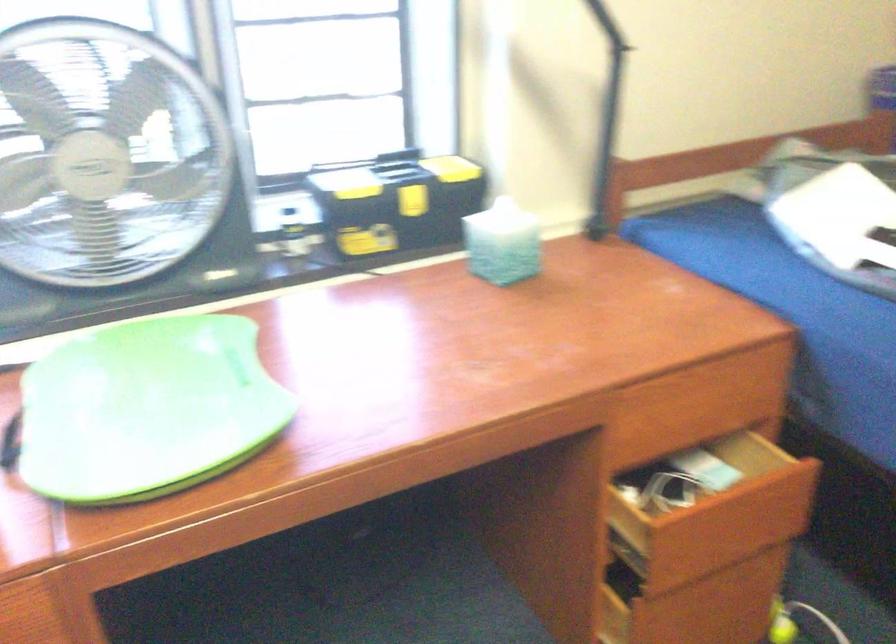
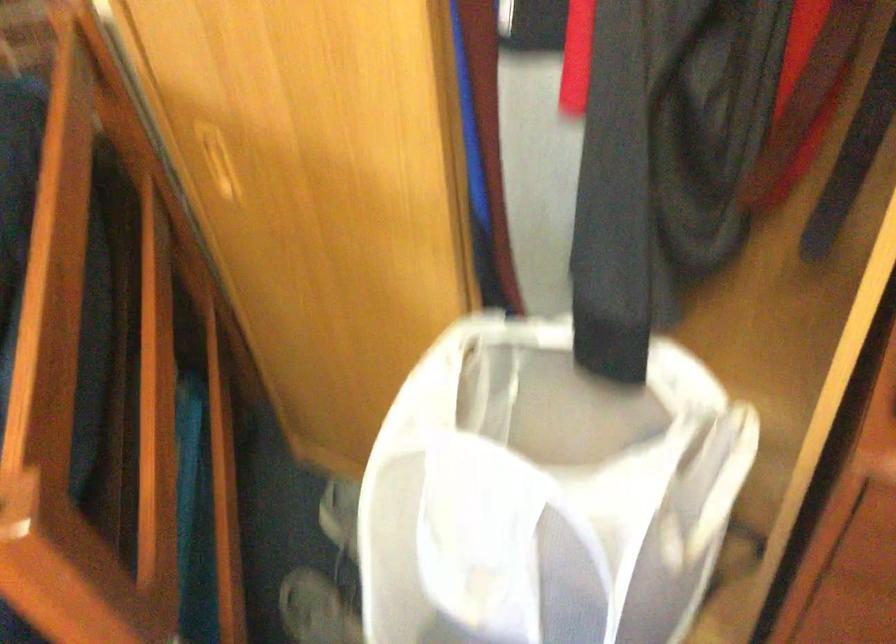
The first image is from the beginning of the video and the second image is from the end. How did the camera likely rotate when shooting the video?

The camera's rotation is toward right-down.